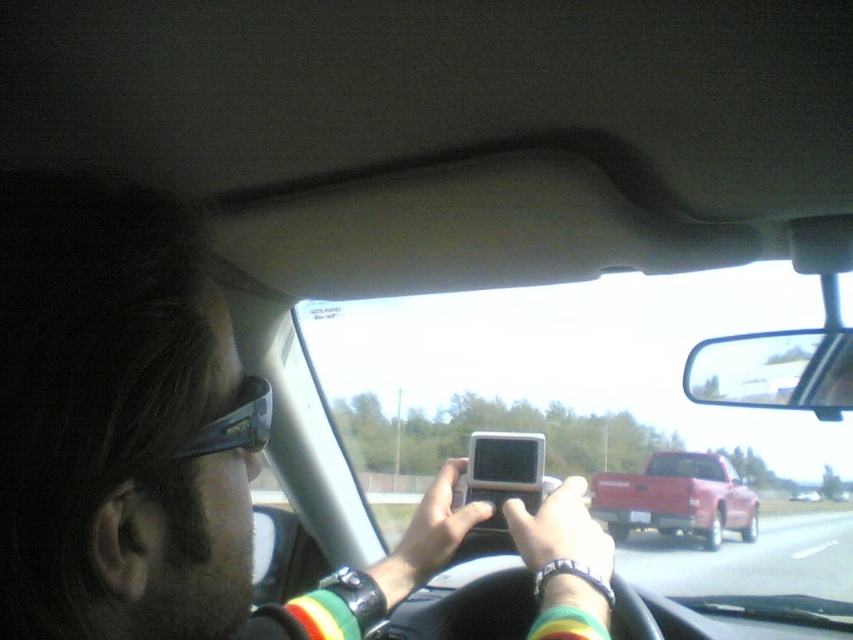
Can you confirm if metallic red truck at center is smaller than matte gray phone at center?

Incorrect, metallic red truck at center is not smaller in size than matte gray phone at center.

Does metallic red truck at center have a larger size compared to matte gray phone at center?

Yes, metallic red truck at center is bigger than matte gray phone at center.

Is point (695, 456) positioned before point (509, 474)?

That is False.

Identify the location of metallic red truck at center. The width and height of the screenshot is (853, 640). (677, 499).

Which of these two, matte plastic phone at center or matte gray phone at center, stands shorter?

matte gray phone at center

Does matte plastic phone at center have a greater height compared to matte gray phone at center?

Yes, matte plastic phone at center is taller than matte gray phone at center.

At what (x,y) coordinates should I click in order to perform the action: click on matte plastic phone at center. Please return your answer as a coordinate pair (x, y). The height and width of the screenshot is (640, 853). Looking at the image, I should click on (433, 531).

Which is above, matte gray phone at center or metallic red truck at center-right?

matte gray phone at center is higher up.

Does matte gray phone at center have a smaller size compared to metallic red truck at center-right?

Yes, matte gray phone at center is smaller than metallic red truck at center-right.

Find the location of `matte gray phone at center`. matte gray phone at center is located at coordinates (503, 472).